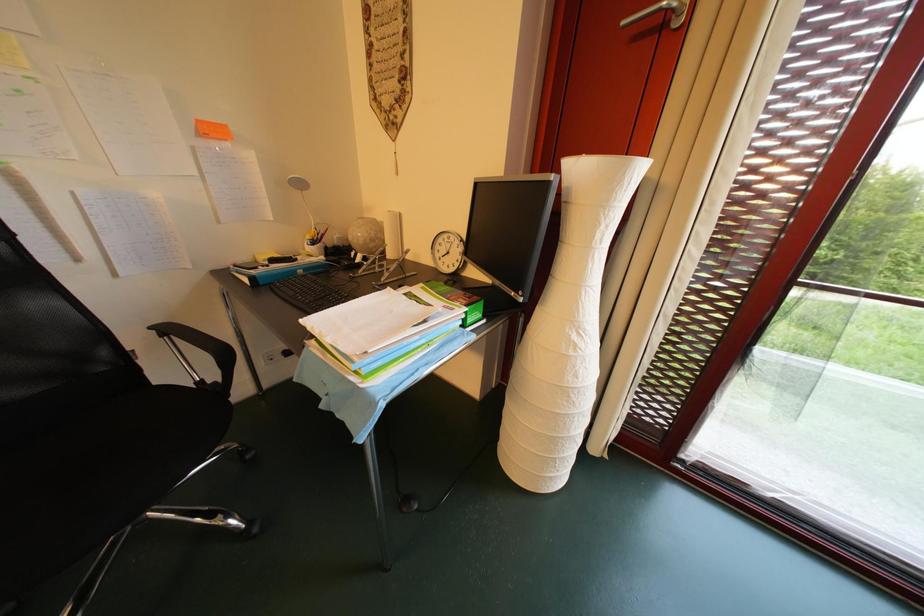
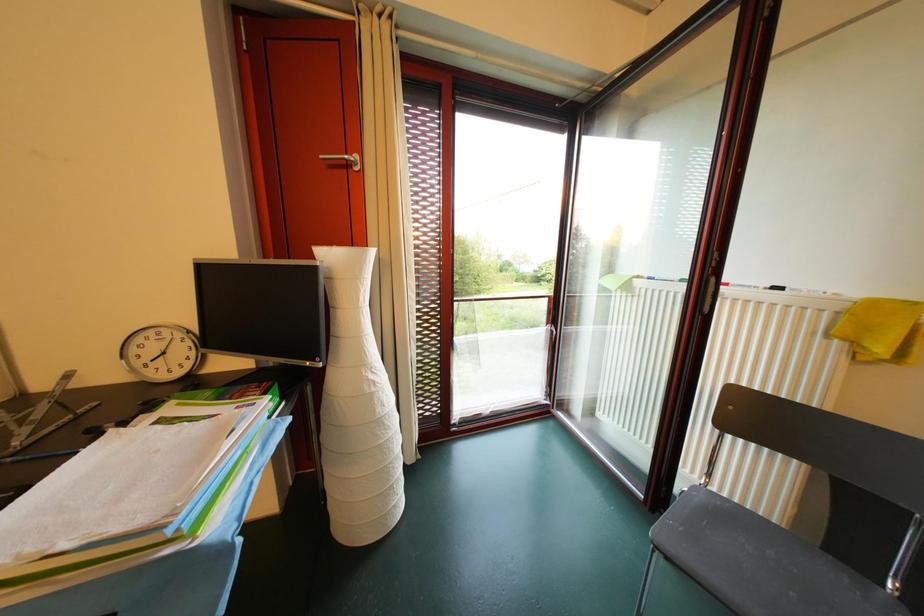
Question: The camera is either moving clockwise (left) or counter-clockwise (right) around the object. The first image is from the beginning of the video and the second image is from the end. Is the camera moving left or right when shooting the video?

Choices:
 (A) Left
 (B) Right

Answer: (A)